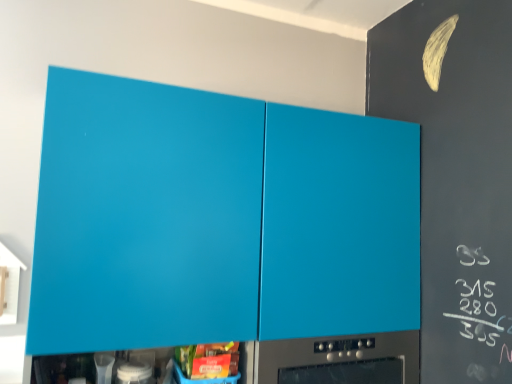
Question: Is white glossy container at lower center next to matte plastic container at lower center?

Choices:
 (A) no
 (B) yes

Answer: (A)

Question: Is white glossy container at lower center positioned in front of matte plastic container at lower center?

Choices:
 (A) yes
 (B) no

Answer: (A)

Question: Is white glossy container at lower center turned away from matte plastic container at lower center?

Choices:
 (A) no
 (B) yes

Answer: (A)

Question: From a real-world perspective, is white glossy container at lower center on matte plastic container at lower center?

Choices:
 (A) no
 (B) yes

Answer: (B)

Question: Does white glossy container at lower center have a smaller size compared to matte plastic container at lower center?

Choices:
 (A) yes
 (B) no

Answer: (A)

Question: From the image's perspective, is matte blue cabinet at upper center above or below matte plastic container at lower center?

Choices:
 (A) above
 (B) below

Answer: (A)

Question: Considering the positions of matte blue cabinet at upper center and matte plastic container at lower center in the image, is matte blue cabinet at upper center taller or shorter than matte plastic container at lower center?

Choices:
 (A) short
 (B) tall

Answer: (B)

Question: Is matte blue cabinet at upper center wider or thinner than matte plastic container at lower center?

Choices:
 (A) thin
 (B) wide

Answer: (B)

Question: Considering the positions of point (256, 109) and point (215, 344), is point (256, 109) closer or farther from the camera than point (215, 344)?

Choices:
 (A) closer
 (B) farther

Answer: (B)

Question: Is matte blue cabinet at upper center bigger or smaller than white glossy container at lower center?

Choices:
 (A) small
 (B) big

Answer: (B)

Question: Would you say matte blue cabinet at upper center is inside or outside white glossy container at lower center?

Choices:
 (A) inside
 (B) outside

Answer: (B)

Question: From the image's perspective, is matte blue cabinet at upper center positioned above or below white glossy container at lower center?

Choices:
 (A) above
 (B) below

Answer: (A)

Question: Does point (155, 160) appear closer or farther from the camera than point (123, 365)?

Choices:
 (A) closer
 (B) farther

Answer: (A)

Question: Is matte plastic container at lower center bigger or smaller than matte blue cabinet at upper center?

Choices:
 (A) big
 (B) small

Answer: (B)

Question: From a real-world perspective, relative to matte blue cabinet at upper center, is matte plastic container at lower center vertically above or below?

Choices:
 (A) below
 (B) above

Answer: (A)